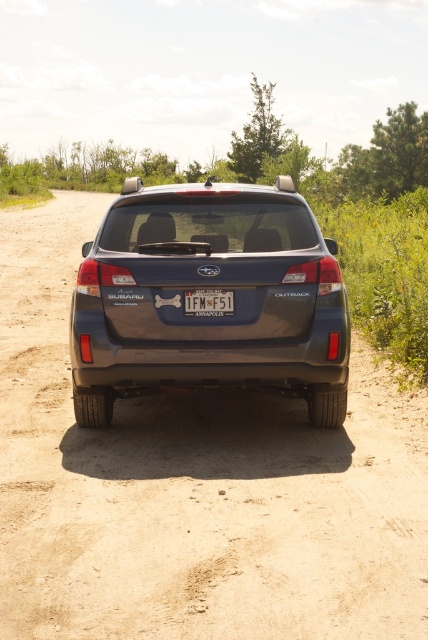
You are standing in front of the Subaru Outback parked on a dirt road. You notice dirtloose sand at center and satin metallic suv at center. Which object is closer to you?

The dirtloose sand at center is closer to the viewer than the satin metallic suv at center according to the description.

You are a photographer trying to capture the Subaru Outback from the rear. You want to ensure that the dirtloose sand at center and the white plastic license plate at center are both clearly visible in your shot. Given their sizes, which object will occupy more space in the photo?

The dirtloose sand at center has a larger width than the white plastic license plate at center, so it will occupy more space in the photo.

You are standing behind the Subaru Outback parked on a dirt road and want to locate two specific points marked on the car. The first point is at coordinates point [243,301] and the second is at point [219,308]. From your vantage point, which point is closer to the front of the car?

Point [243,301] is in front of point [219,308], so the first point is closer to the front of the car.